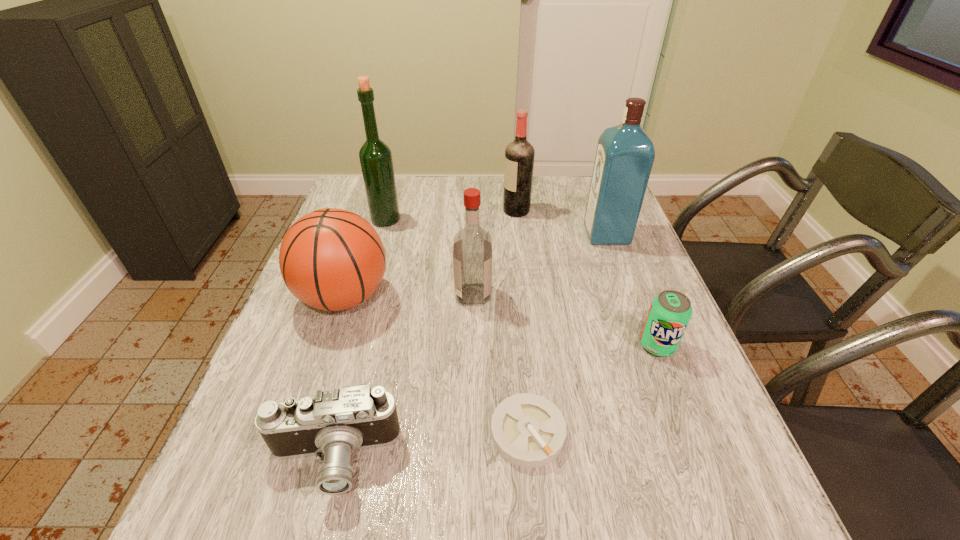
Image resolution: width=960 pixels, height=540 pixels. Identify the location of free space at the right edge. (730, 477).

Locate an element on the screen. free space at the far right corner of the desktop is located at coordinates (585, 177).

What are the coordinates of `vacant space at the near right corner of the desktop` in the screenshot? It's located at (717, 519).

Locate an element on the screen. This screenshot has height=540, width=960. free spot between the camera and the nearest liquor is located at coordinates (403, 377).

At what (x,y) coordinates should I click in order to perform the action: click on free space between the camera and the third liquor from left to right. Please return your answer as a coordinate pair (x, y). The width and height of the screenshot is (960, 540). Looking at the image, I should click on (424, 335).

The height and width of the screenshot is (540, 960). I want to click on free spot between the rightmost liquor and the camera, so click(469, 347).

The image size is (960, 540). I want to click on free area in between the second liquor from right to left and the shortest object, so click(x=522, y=321).

Where is `free space that is in between the third liquor from right to left and the pop soda`? The image size is (960, 540). free space that is in between the third liquor from right to left and the pop soda is located at coordinates (565, 320).

Find the location of a particular element. This screenshot has height=540, width=960. free spot between the pop soda and the camera is located at coordinates (495, 402).

The width and height of the screenshot is (960, 540). Find the location of `empty location between the leftmost liquor and the pop soda`. empty location between the leftmost liquor and the pop soda is located at coordinates (521, 283).